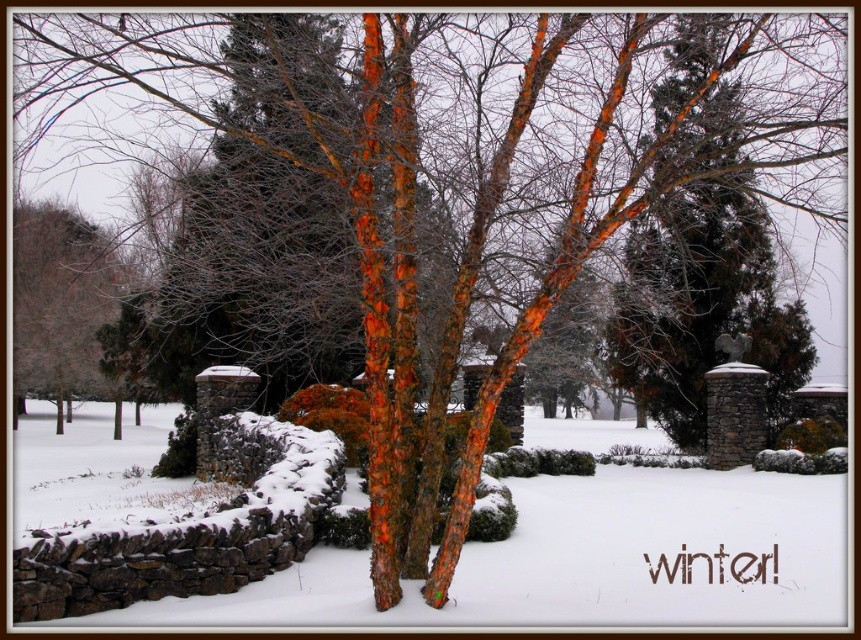
Which is behind, point (289, 588) or point (73, 356)?

Point (73, 356)

Based on the photo, is white powdery snow at center to the right of brown bark tree at left from the viewer's perspective?

Indeed, white powdery snow at center is positioned on the right side of brown bark tree at left.

The width and height of the screenshot is (861, 640). Describe the element at coordinates (584, 557) in the screenshot. I see `white powdery snow at center` at that location.

Locate an element on the screen. This screenshot has height=640, width=861. white powdery snow at center is located at coordinates (584, 557).